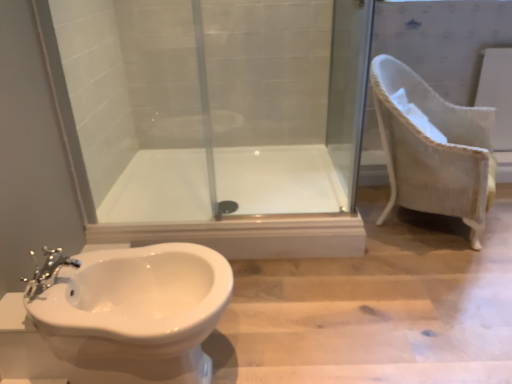
This screenshot has height=384, width=512. I want to click on vacant area that lies in front of transparent glass screen door at center, so click(323, 193).